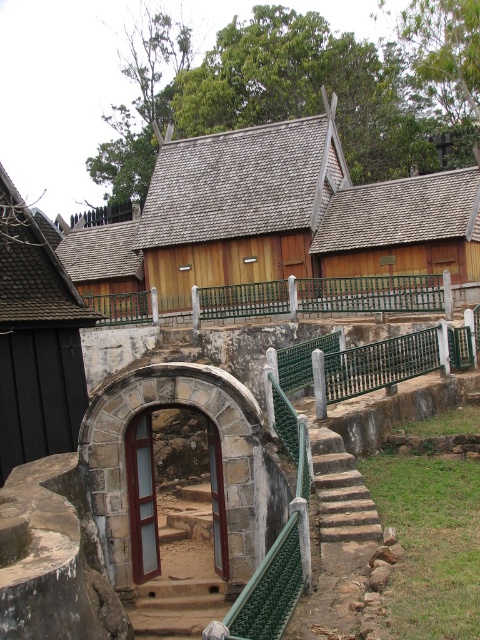
Can you confirm if dark brown wood at left is positioned below stone textured stairs at center?

No, dark brown wood at left is not below stone textured stairs at center.

Measure the distance between dark brown wood at left and stone textured stairs at center.

dark brown wood at left is 8.58 meters away from stone textured stairs at center.

What do you see at coordinates (36, 340) in the screenshot?
I see `dark brown wood at left` at bounding box center [36, 340].

Locate an element on the screen. dark brown wood at left is located at coordinates (36, 340).

What do you see at coordinates (276, 218) in the screenshot?
I see `wooden hut at center` at bounding box center [276, 218].

Can you confirm if wooden hut at center is smaller than dark brown wood at left?

Incorrect, wooden hut at center is not smaller in size than dark brown wood at left.

Find the location of a particular element. The height and width of the screenshot is (640, 480). wooden hut at center is located at coordinates (276, 218).

This screenshot has width=480, height=640. I want to click on wooden hut at center, so click(276, 218).

Is wooden hut at center wider than brown stone stairs at center?

Correct, the width of wooden hut at center exceeds that of brown stone stairs at center.

Does wooden hut at center appear on the right side of brown stone stairs at center?

No, wooden hut at center is not to the right of brown stone stairs at center.

Is point (85, 260) behind point (158, 582)?

Yes, point (85, 260) is behind point (158, 582).

Locate an element on the screen. wooden hut at center is located at coordinates (276, 218).